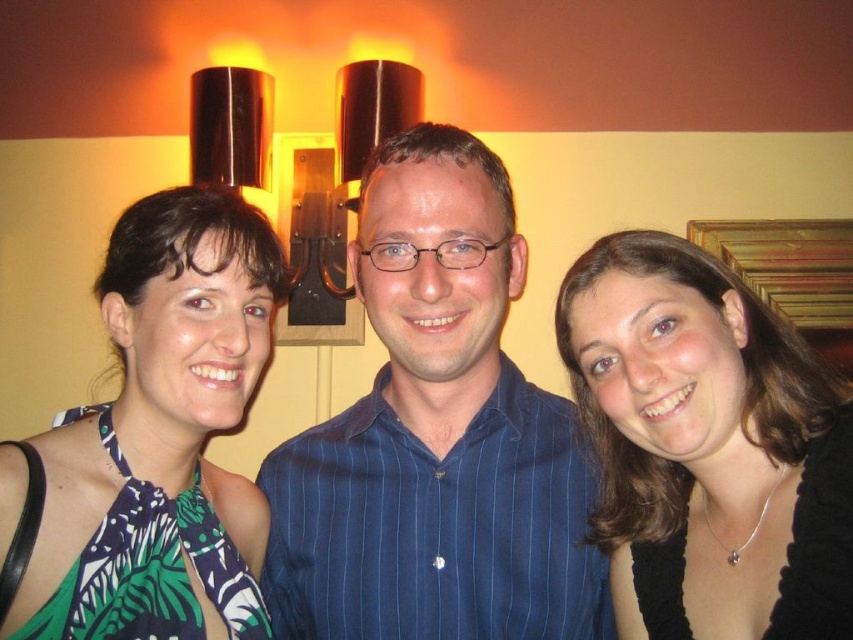
In the image, there are a matte black necklace at right and a green printed dress at center. Which object is positioned lower in the scene?

The matte black necklace at right is located below the green printed dress at center, so it is positioned lower in the scene.

You are a photographer trying to focus on the blue striped shirt at center and the matte black necklace at right. Which object should you adjust your focus to first if you want to capture both clearly?

The blue striped shirt at center is positioned over matte black necklace at right, so you should focus on the blue striped shirt at center first to ensure it is in focus before adjusting for the matte black necklace at right.